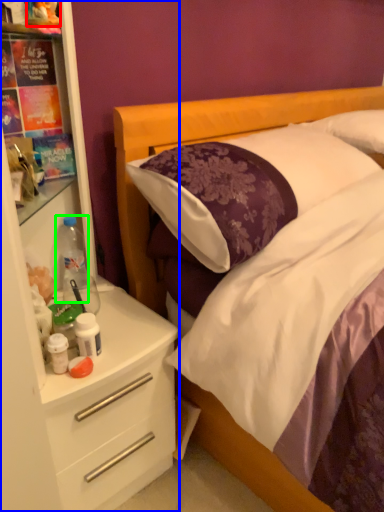
Question: Estimate the real-world distances between objects in this image. Which object is closer to toy (highlighted by a red box), dresser (highlighted by a blue box) or bottle (highlighted by a green box)?

Choices:
 (A) dresser
 (B) bottle

Answer: (B)